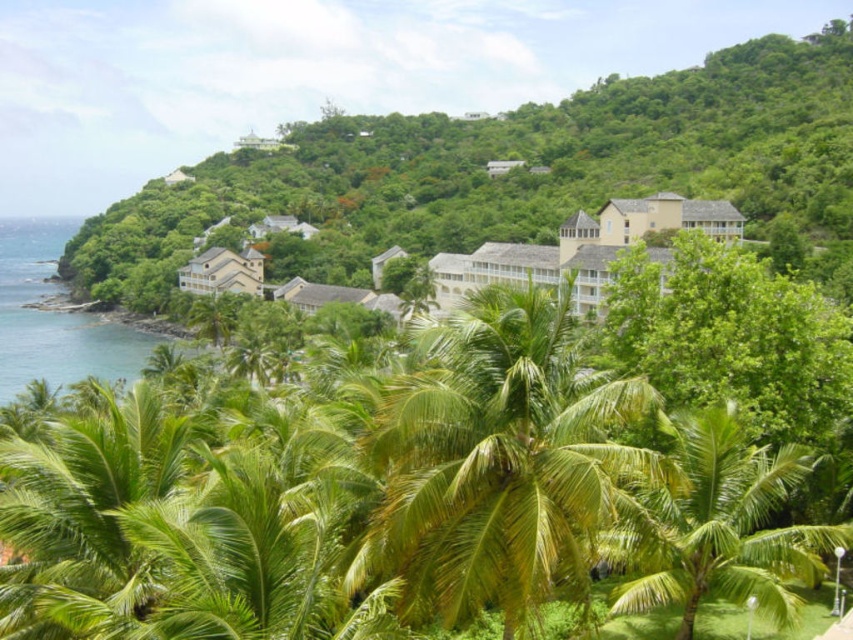
Question: Is yellow matte building at center further to the viewer compared to white matte building at center?

Choices:
 (A) yes
 (B) no

Answer: (B)

Question: Does green leafy palm tree at center have a greater width compared to yellow matte building at center?

Choices:
 (A) yes
 (B) no

Answer: (B)

Question: Which point is closer to the camera?

Choices:
 (A) green leafy palm tree at lower right
 (B) yellow matte building at center

Answer: (A)

Question: Which of the following is the farthest from the observer?

Choices:
 (A) white matte building at center
 (B) green leafy palm tree at lower right
 (C) yellow matte building at center
 (D) green leafy palm tree at center

Answer: (A)

Question: Considering the relative positions of green leafy palm tree at lower right and white matte building at center in the image provided, where is green leafy palm tree at lower right located with respect to white matte building at center?

Choices:
 (A) right
 (B) left

Answer: (A)

Question: Which point appears farthest from the camera in this image?

Choices:
 (A) (233, 273)
 (B) (656, 524)
 (C) (732, 205)

Answer: (A)